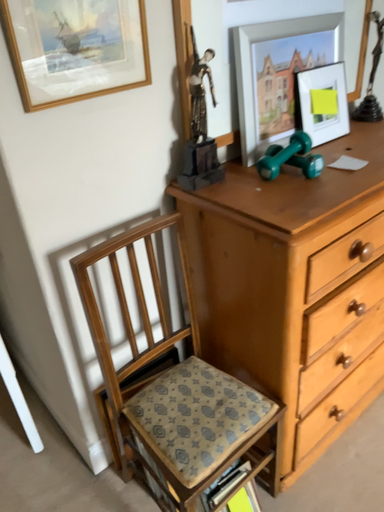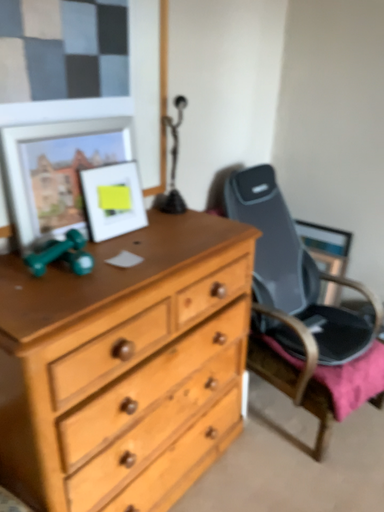
Question: How did the camera likely rotate when shooting the video?

Choices:
 (A) rotated left
 (B) rotated right

Answer: (B)